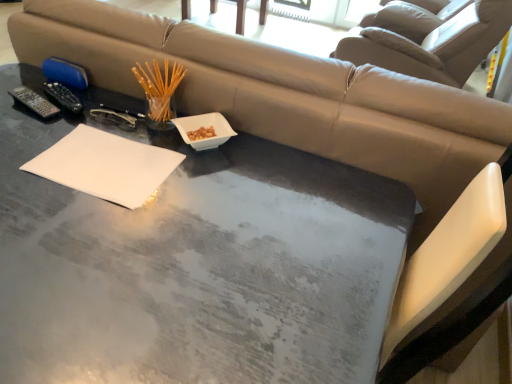
Where is `free space between black plastic remote at left and translucent glass chopsticks at upper left`? free space between black plastic remote at left and translucent glass chopsticks at upper left is located at coordinates (109, 118).